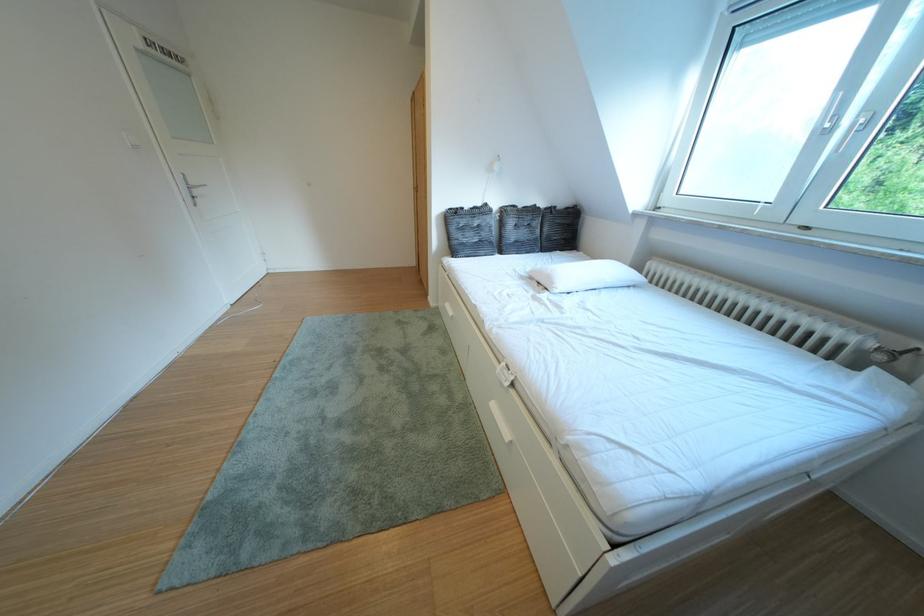
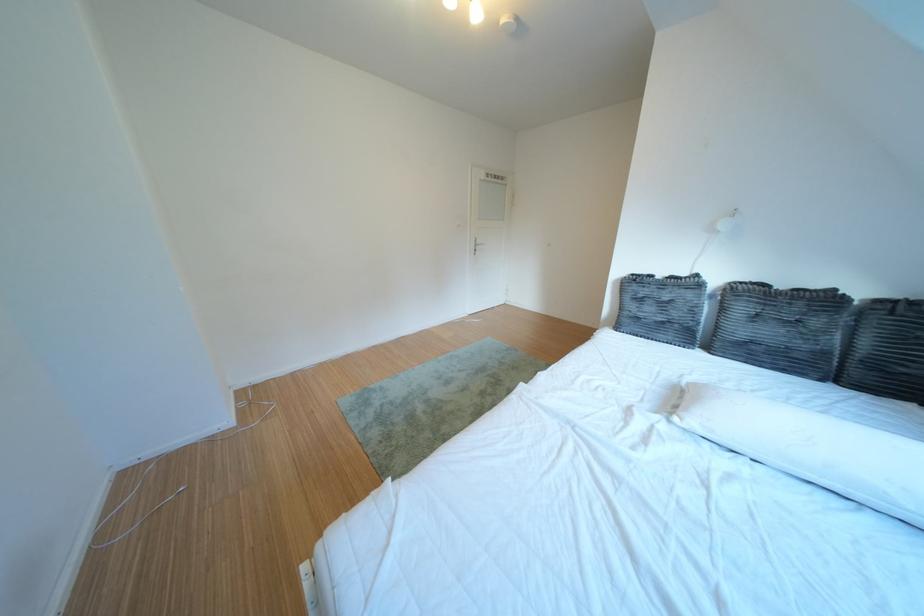
Question: The camera is either moving clockwise (left) or counter-clockwise (right) around the object. The first image is from the beginning of the video and the second image is from the end. Is the camera moving left or right when shooting the video?

Choices:
 (A) Left
 (B) Right

Answer: (B)